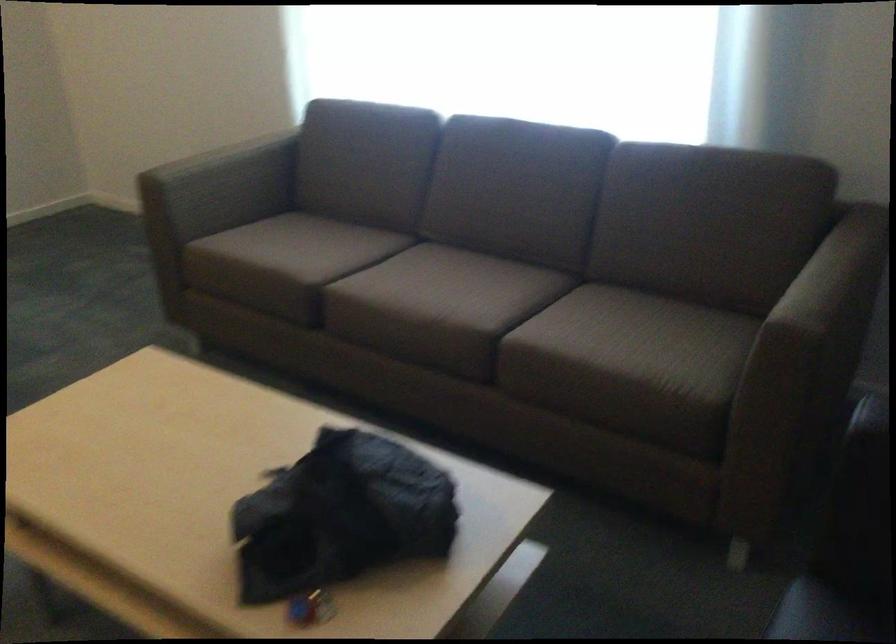
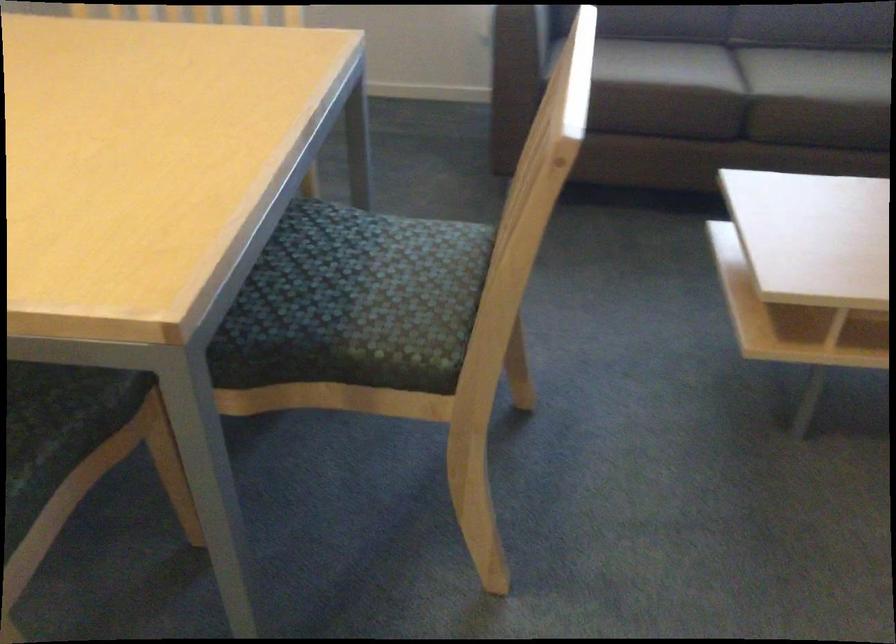
Question: In a continuous first-person perspective shot, in which direction is the camera moving?

Choices:
 (A) Left
 (B) Right
 (C) Forward
 (D) Backward

Answer: (A)